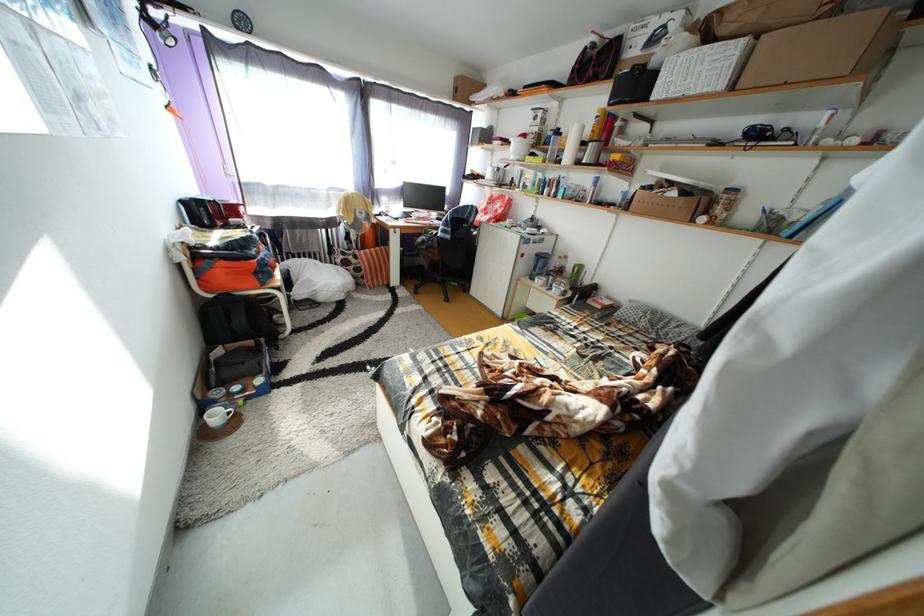
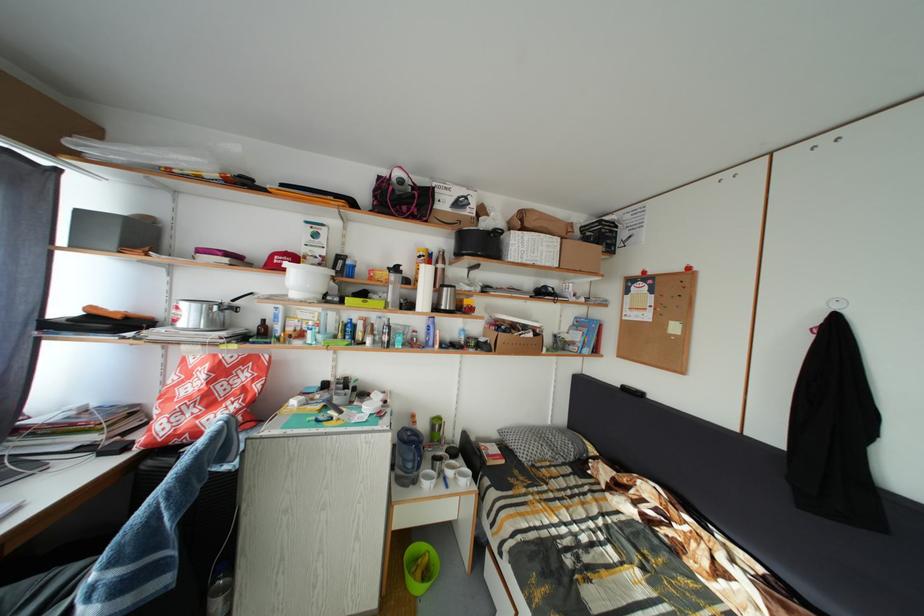
The point at (x=682, y=200) is marked in the first image. Where is the corresponding point in the second image?

(540, 341)